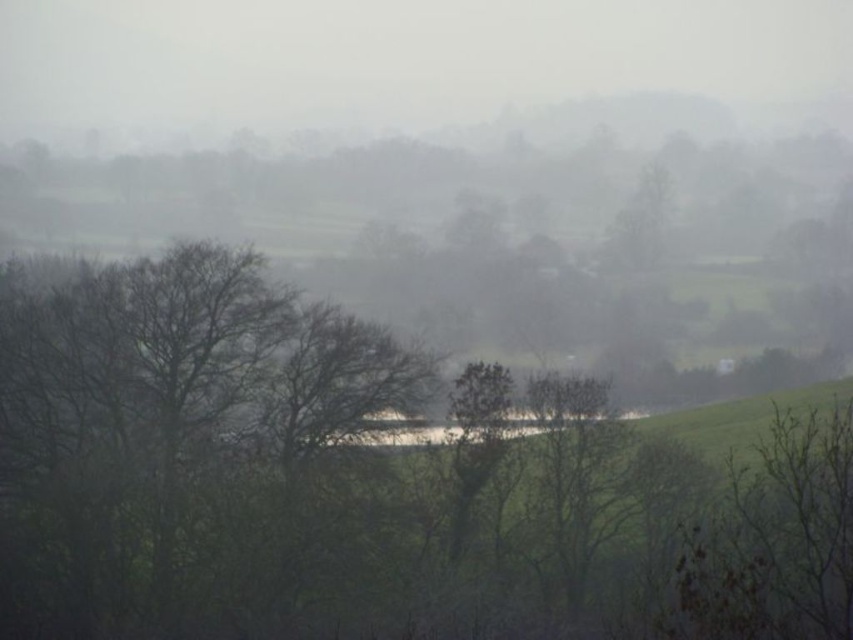
Who is positioned more to the left, green matte tree at lower right or green leafy tree at center?

green leafy tree at center is more to the left.

What are the coordinates of `green matte tree at lower right` in the screenshot? It's located at (776, 538).

Which is below, green matte tree at center or green leafy tree at center?

green matte tree at center is below.

Does green matte tree at center have a smaller size compared to green leafy tree at center?

Actually, green matte tree at center might be larger than green leafy tree at center.

Which is behind, point (293, 625) or point (495, 384)?

The point (495, 384) is more distant.

You are a GUI agent. You are given a task and a screenshot of the screen. Output one action in this format:
    pyautogui.click(x=<x>, y=<y>)
    Task: Click on the green matte tree at center
    This screenshot has height=640, width=853.
    Given the screenshot: What is the action you would take?
    pyautogui.click(x=363, y=486)

Can you confirm if green matte tree at center is positioned to the right of green matte tree at lower right?

No, green matte tree at center is not to the right of green matte tree at lower right.

Can you confirm if green matte tree at center is taller than green matte tree at lower right?

Indeed, green matte tree at center has a greater height compared to green matte tree at lower right.

Measure the distance between point (840, 465) and camera.

Point (840, 465) is 21.41 meters from camera.

You are a GUI agent. You are given a task and a screenshot of the screen. Output one action in this format:
    pyautogui.click(x=<x>, y=<y>)
    Task: Click on the green matte tree at center
    
    Given the screenshot: What is the action you would take?
    pyautogui.click(x=363, y=486)